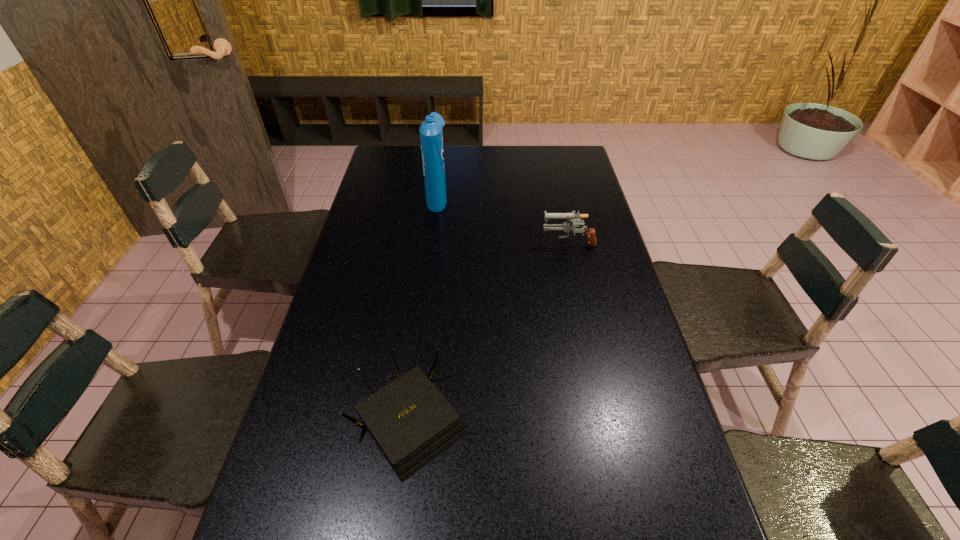
Where is `vacant region located 0.130m on the back of the nearest object`? vacant region located 0.130m on the back of the nearest object is located at coordinates (420, 333).

Image resolution: width=960 pixels, height=540 pixels. What are the coordinates of `object located at the left edge` in the screenshot? It's located at [x=411, y=422].

What are the coordinates of `object located in the right edge section of the desktop` in the screenshot? It's located at (566, 226).

This screenshot has width=960, height=540. What are the coordinates of `free region at the far edge of the desktop` in the screenshot? It's located at (454, 160).

You are a GUI agent. You are given a task and a screenshot of the screen. Output one action in this format:
    pyautogui.click(x=<x>, y=<y>)
    Task: Click on the free space at the left edge of the desktop
    The width and height of the screenshot is (960, 540).
    Given the screenshot: What is the action you would take?
    pyautogui.click(x=407, y=183)

You are a GUI agent. You are given a task and a screenshot of the screen. Output one action in this format:
    pyautogui.click(x=<x>, y=<y>)
    Task: Click on the free space at the right edge of the desktop
    The height and width of the screenshot is (540, 960).
    Given the screenshot: What is the action you would take?
    pyautogui.click(x=571, y=247)

What are the coordinates of `vacant space at the far right corner of the desktop` in the screenshot? It's located at (x=569, y=154).

Where is `free space between the farthest object and the gun`? The height and width of the screenshot is (540, 960). free space between the farthest object and the gun is located at coordinates (503, 220).

Locate an element on the screen. The height and width of the screenshot is (540, 960). free point between the gun and the shortest object is located at coordinates (489, 333).

Locate an element on the screen. vacant region between the shortest object and the shampoo is located at coordinates (423, 310).